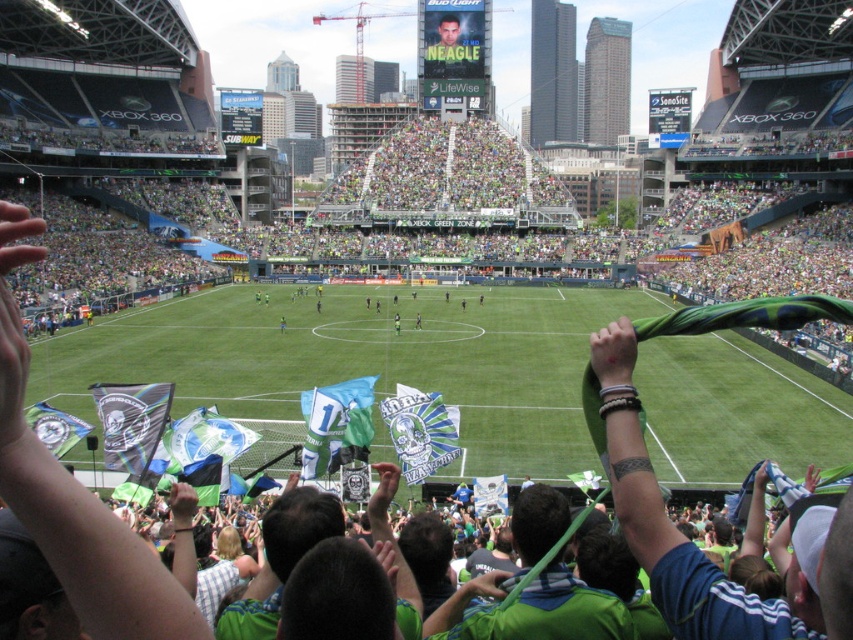
You are a drone operator trying to capture the best aerial shot of the soccer match. The stadium has a rectangular field with the center marked by a white circle. You need to position your drone exactly at point (361, 362) on the field coordinates. What will the drone be hovering over?

The point (361, 362) corresponds to green grass at center, so the drone will be hovering over the green grass at center.

Looking at this image, you are a photographer standing at the camera position. You want to take a closeup shot of the point at coordinates (397, 422). Considering the distance, will you need a zoom lens to capture this detail clearly?

The point at coordinates (397, 422) is 62.21 meters away from the camera. To capture such a distant detail clearly, a zoom lens would be necessary to magnify the subject sufficiently.